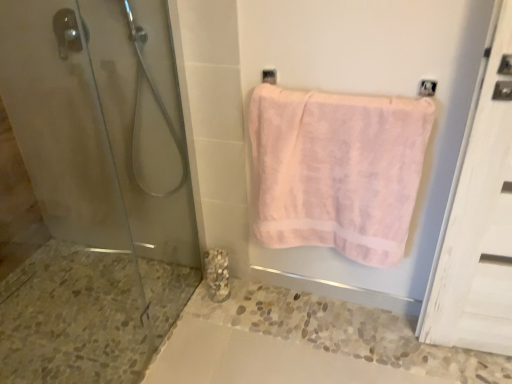
Where is `free space behind transparent glass shower door at left`? Image resolution: width=512 pixels, height=384 pixels. free space behind transparent glass shower door at left is located at coordinates (125, 289).